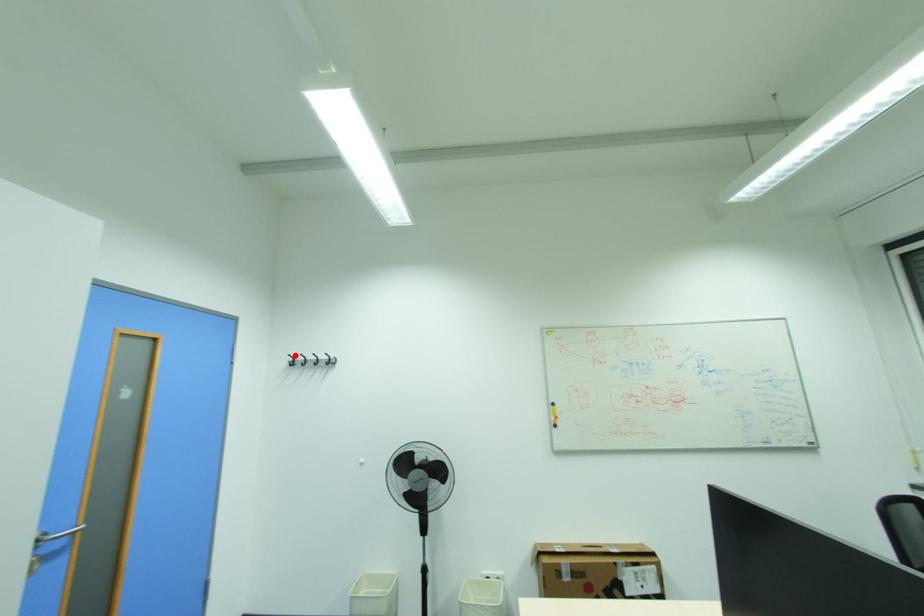
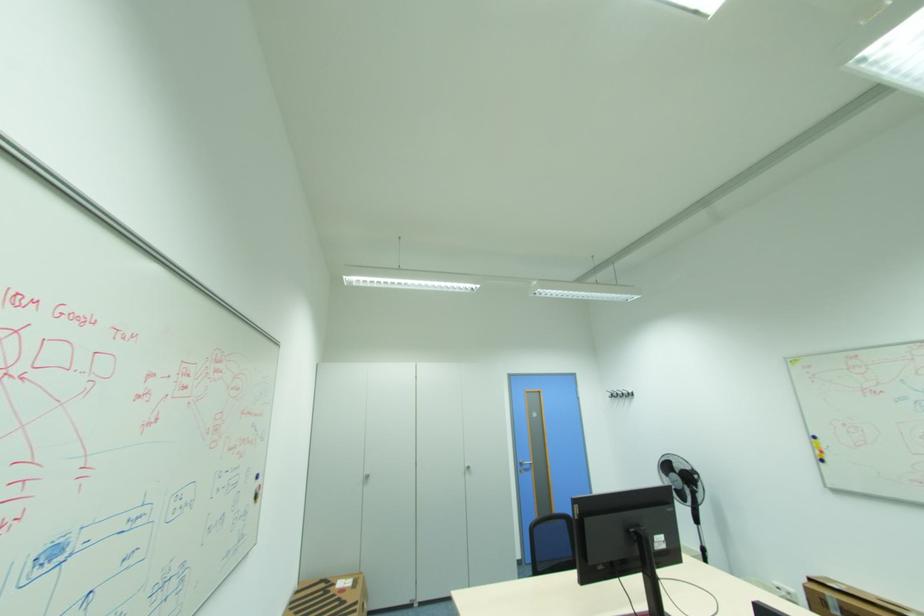
In the second image, find the point that corresponds to the highlighted location in the first image.

(613, 391)